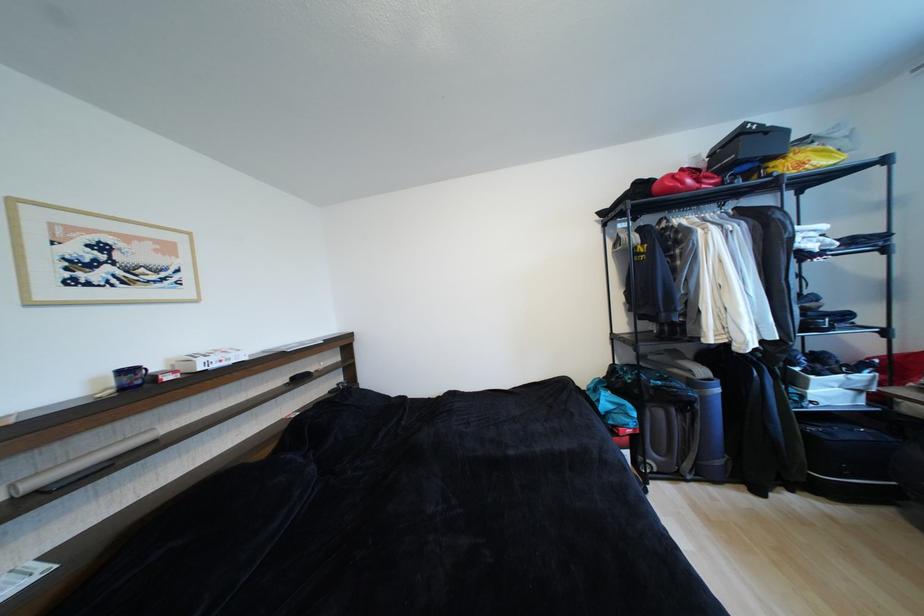
The location [685,180] corresponds to which object?

This point indicates the red bag.